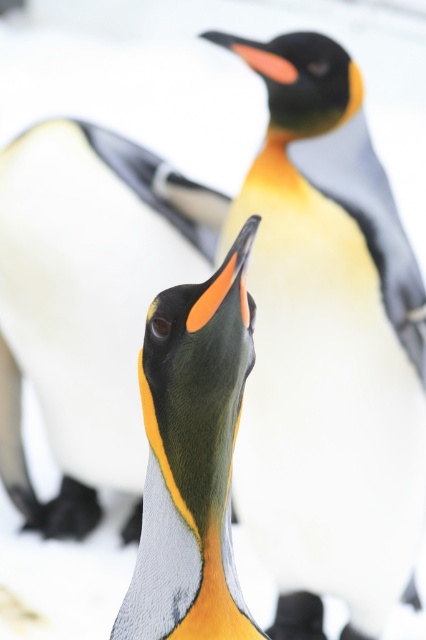
Question: Which object appears farthest from the camera in this image?

Choices:
 (A) matte orange beak at center
 (B) matte black penguin at center

Answer: (B)

Question: Which of the following is the closest to the observer?

Choices:
 (A) yellow-orange feathers at center
 (B) matte orange beak at center

Answer: (B)

Question: Which of the following is the farthest from the observer?

Choices:
 (A) [x=411, y=250]
 (B) [x=229, y=429]
 (C) [x=51, y=356]

Answer: (C)

Question: Does matte black penguin at center lie behind matte orange beak at center?

Choices:
 (A) yes
 (B) no

Answer: (A)

Question: Can you confirm if yellow-orange feathers at center is positioned above matte black penguin at center?

Choices:
 (A) yes
 (B) no

Answer: (B)

Question: Can you confirm if yellow-orange feathers at center is bigger than matte orange beak at center?

Choices:
 (A) no
 (B) yes

Answer: (B)